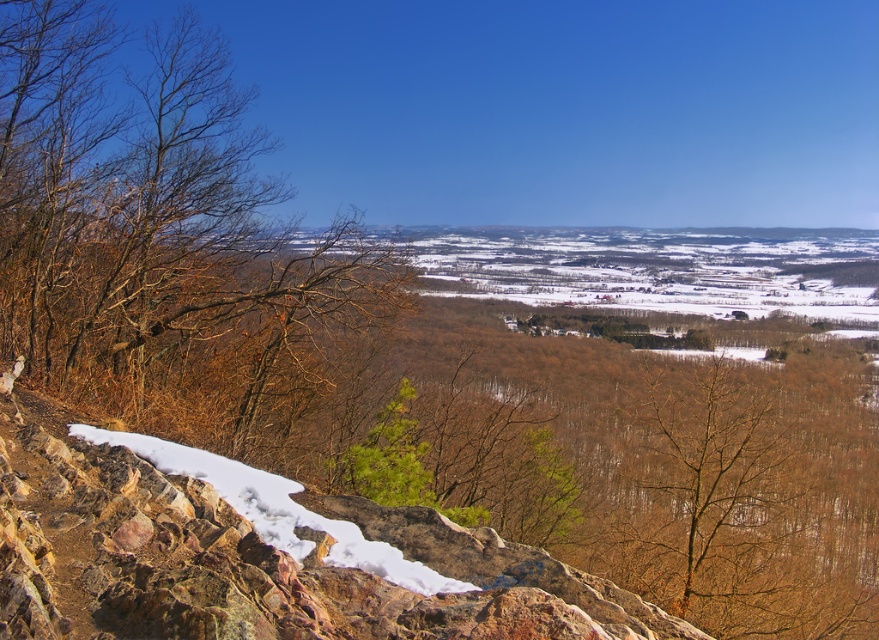
In the scene shown: You are an artist sketching the landscape and want to capture the height differences between the brown leafless branches at left and the brown leafless tree at center. Which one should you draw taller in your sketch?

The brown leafless branches at left should be drawn taller than the brown leafless tree at center because they have a greater height according to the description.

You are an observer looking at the scene. You notice the brown leafless branches at left and the brown leafless tree at center. Which one appears closer to you?

The brown leafless branches at left appears closer because it is in front of the brown leafless tree at center.

You are an artist sketching the landscape and want to ensure accuracy. Which of the two objects, the brown leafless branches at left or the brown leafless tree at center, has a wider spread?

The brown leafless branches at left might be wider than the brown leafless tree at center according to the description provided.